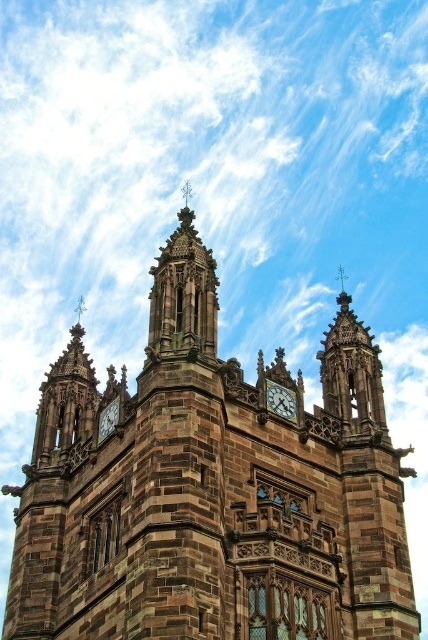
You are standing in front of a Gothic building and notice two structures at the center. Which one is positioned to the left of the other? The structures are the brown stone church at center and the polished stone clock at center.

The brown stone church at center is positioned to the left of the polished stone clock at center.

In the scene shown: You are standing in front of the grand Gothic building and notice two points marked on its facade. The first point is at coordinates point (267,408) and the second is at point (115,401). Which of these two points is closer to your current position?

Point (267,408) is closer to the camera than point (115,401), so the first point is closer to your position.

You are an architect designing a new garden layout around the brown stone church at center and the polished stone clock at center. To ensure proper spacing, you need to know which structure is wider. Which one is wider?

The brown stone church at center is wider than the polished stone clock at center according to the description provided.